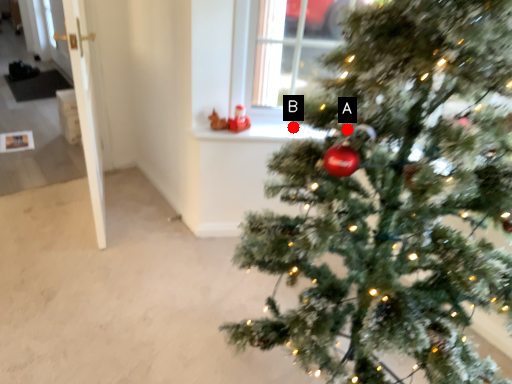
Question: Two points are circled on the image, labeled by A and B beside each circle. Which point is farther to the camera?

Choices:
 (A) A is further
 (B) B is further

Answer: (B)